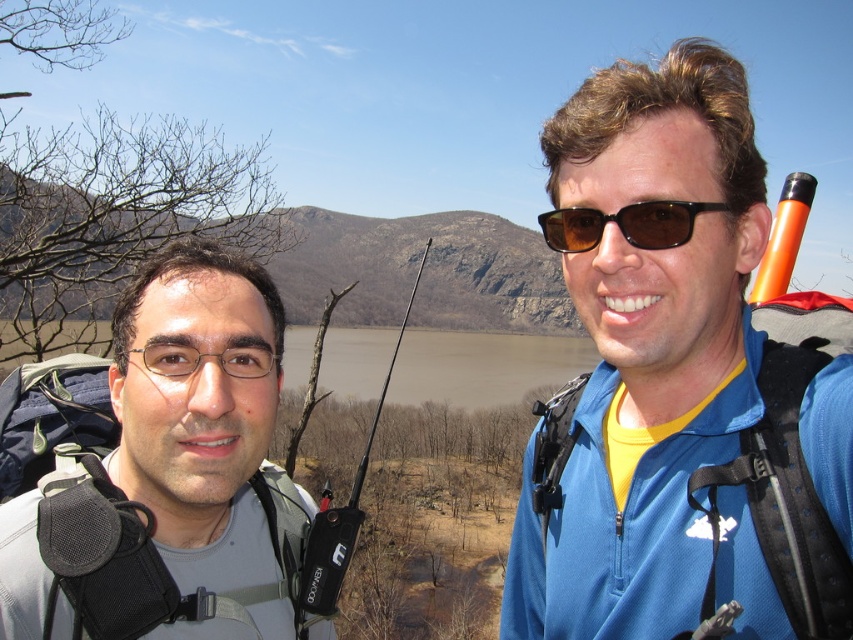
You are a photographer standing at the edge of the water. You want to take a photo that includes both the blue fabric jacket at center and the brown matte sunglasses at upper right. Which object should you adjust your camera angle to focus on first to ensure both fit in the frame?

The blue fabric jacket at center is wider than the brown matte sunglasses at upper right, so you should focus on the blue fabric jacket at center first to ensure both fit in the frame.